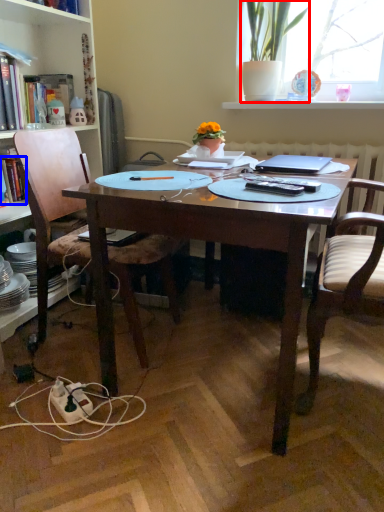
Question: Which object is further to the camera taking this photo, houseplant (highlighted by a red box) or book (highlighted by a blue box)?

Choices:
 (A) houseplant
 (B) book

Answer: (B)